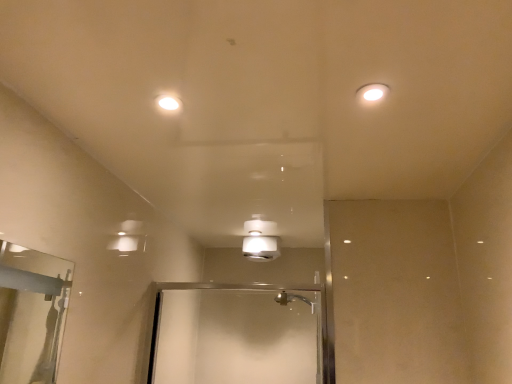
Measure the distance between white glossy light fixture at upper right, the 2th light fixture positioned from the left, and camera.

They are 3.59 feet apart.

What do you see at coordinates (372, 93) in the screenshot?
I see `white glossy light fixture at upper right, which is the 1th light fixture in top-to-bottom order` at bounding box center [372, 93].

You are a GUI agent. You are given a task and a screenshot of the screen. Output one action in this format:
    pyautogui.click(x=<x>, y=<y>)
    Task: Click on the white glossy light fixture at upper right, the 1th light fixture positioned from the front
    The image size is (512, 384).
    Given the screenshot: What is the action you would take?
    pyautogui.click(x=372, y=93)

This screenshot has width=512, height=384. What do you see at coordinates (259, 241) in the screenshot?
I see `white glossy light fixture at center, which ranks as the 1th light fixture in bottom-to-top order` at bounding box center [259, 241].

At what (x,y) coordinates should I click in order to perform the action: click on white glossy light fixture at center, which is counted as the second light fixture, starting from the front. Please return your answer as a coordinate pair (x, y). The image size is (512, 384). Looking at the image, I should click on (259, 241).

Measure the distance between white glossy light fixture at center, the first light fixture when ordered from left to right, and camera.

white glossy light fixture at center, the first light fixture when ordered from left to right, and camera are 7.42 feet apart.

Image resolution: width=512 pixels, height=384 pixels. I want to click on white glossy light fixture at upper right, the 1th light fixture positioned from the front, so click(372, 93).

Looking at this image, visually, is white glossy light fixture at center, which is counted as the second light fixture, starting from the front, positioned to the left or to the right of white glossy light fixture at upper right, which is the 1th light fixture in top-to-bottom order?

In the image, white glossy light fixture at center, which is counted as the second light fixture, starting from the front, appears on the left side of white glossy light fixture at upper right, which is the 1th light fixture in top-to-bottom order.

Considering the positions of objects white glossy light fixture at center, which is counted as the second light fixture, starting from the front, and white glossy light fixture at upper right, the second light fixture viewed from the back, in the image provided, who is in front, white glossy light fixture at center, which is counted as the second light fixture, starting from the front, or white glossy light fixture at upper right, the second light fixture viewed from the back,?

white glossy light fixture at upper right, the second light fixture viewed from the back.

Which point is more distant from viewer, [264,236] or [369,95]?

Positioned behind is point [264,236].

From the image's perspective, would you say white glossy light fixture at center, which ranks as the 1th light fixture in bottom-to-top order, is positioned over white glossy light fixture at upper right, the 2th light fixture positioned from the left?

Actually, white glossy light fixture at center, which ranks as the 1th light fixture in bottom-to-top order, appears below white glossy light fixture at upper right, the 2th light fixture positioned from the left, in the image.

From a real-world perspective, does white glossy light fixture at center, which is the 2th light fixture from top to bottom, sit lower than white glossy light fixture at upper right, the second light fixture viewed from the back?

Indeed, from a real-world perspective, white glossy light fixture at center, which is the 2th light fixture from top to bottom, is positioned beneath white glossy light fixture at upper right, the second light fixture viewed from the back.

Which object is wider, white glossy light fixture at center, which ranks as the 1th light fixture in bottom-to-top order, or white glossy light fixture at upper right, the second light fixture in the bottom-to-top sequence?

white glossy light fixture at center, which ranks as the 1th light fixture in bottom-to-top order.

In terms of height, does white glossy light fixture at center, the first light fixture when ordered from left to right, look taller or shorter compared to white glossy light fixture at upper right, the 2th light fixture positioned from the left?

Clearly, white glossy light fixture at center, the first light fixture when ordered from left to right, is taller compared to white glossy light fixture at upper right, the 2th light fixture positioned from the left.

Is white glossy light fixture at center, the second light fixture from the right, bigger or smaller than white glossy light fixture at upper right, the second light fixture in the bottom-to-top sequence?

Clearly, white glossy light fixture at center, the second light fixture from the right, is larger in size than white glossy light fixture at upper right, the second light fixture in the bottom-to-top sequence.

Which is correct: white glossy light fixture at center, which ranks as the 1th light fixture in bottom-to-top order, is inside white glossy light fixture at upper right, the 1th light fixture positioned from the front, or outside of it?

white glossy light fixture at center, which ranks as the 1th light fixture in bottom-to-top order, is spatially situated outside white glossy light fixture at upper right, the 1th light fixture positioned from the front.

Is the surface of white glossy light fixture at center, which ranks as the 1th light fixture in bottom-to-top order, in direct contact with white glossy light fixture at upper right, the 2th light fixture positioned from the left?

No, white glossy light fixture at center, which ranks as the 1th light fixture in bottom-to-top order, is not touching white glossy light fixture at upper right, the 2th light fixture positioned from the left.

Is white glossy light fixture at center, which is counted as the second light fixture, starting from the front, oriented away from white glossy light fixture at upper right, the second light fixture in the bottom-to-top sequence?

white glossy light fixture at center, which is counted as the second light fixture, starting from the front, is not turned away from white glossy light fixture at upper right, the second light fixture in the bottom-to-top sequence.

What's the angular difference between white glossy light fixture at center, which appears as the first light fixture when viewed from the back, and white glossy light fixture at upper right, which is the 1th light fixture in top-to-bottom order,'s facing directions?

There is a 0.00252-degree angle between the facing directions of white glossy light fixture at center, which appears as the first light fixture when viewed from the back, and white glossy light fixture at upper right, which is the 1th light fixture in top-to-bottom order.

How much distance is there between white glossy light fixture at center, the first light fixture when ordered from left to right, and white glossy light fixture at upper right, arranged as the first light fixture when viewed from the right?

The distance of white glossy light fixture at center, the first light fixture when ordered from left to right, from white glossy light fixture at upper right, arranged as the first light fixture when viewed from the right, is 1.49 meters.

Where is `light fixture beneath the white glossy light fixture at upper right, arranged as the first light fixture when viewed from the right (from a real-world perspective)`? The image size is (512, 384). light fixture beneath the white glossy light fixture at upper right, arranged as the first light fixture when viewed from the right (from a real-world perspective) is located at coordinates (259, 241).

Which is more to the right, white glossy light fixture at upper right, the second light fixture in the bottom-to-top sequence, or white glossy light fixture at center, which is the 2th light fixture from top to bottom?

Positioned to the right is white glossy light fixture at upper right, the second light fixture in the bottom-to-top sequence.

Which object is closer to the camera, white glossy light fixture at upper right, which is the 1th light fixture in top-to-bottom order, or white glossy light fixture at center, the second light fixture from the right?

white glossy light fixture at upper right, which is the 1th light fixture in top-to-bottom order, is more forward.

Does point (375, 85) come farther from viewer compared to point (254, 223)?

No, it is in front of (254, 223).

From the image's perspective, which object appears higher, white glossy light fixture at upper right, the 2th light fixture positioned from the left, or white glossy light fixture at center, which appears as the first light fixture when viewed from the back?

From the image's view, white glossy light fixture at upper right, the 2th light fixture positioned from the left, is above.

From a real-world perspective, who is located lower, white glossy light fixture at upper right, the second light fixture viewed from the back, or white glossy light fixture at center, which is counted as the second light fixture, starting from the front?

white glossy light fixture at center, which is counted as the second light fixture, starting from the front, from a real-world perspective.

Is white glossy light fixture at upper right, arranged as the first light fixture when viewed from the right, wider or thinner than white glossy light fixture at center, which is counted as the second light fixture, starting from the front?

white glossy light fixture at upper right, arranged as the first light fixture when viewed from the right, is thinner than white glossy light fixture at center, which is counted as the second light fixture, starting from the front.

Is white glossy light fixture at upper right, arranged as the first light fixture when viewed from the right, taller than white glossy light fixture at center, which appears as the first light fixture when viewed from the back?

No.

From the picture: Is white glossy light fixture at upper right, the 2th light fixture positioned from the left, bigger or smaller than white glossy light fixture at center, which is the 2th light fixture from top to bottom?

→ white glossy light fixture at upper right, the 2th light fixture positioned from the left, is smaller than white glossy light fixture at center, which is the 2th light fixture from top to bottom.

Is white glossy light fixture at upper right, the 1th light fixture positioned from the front, spatially inside white glossy light fixture at center, which is the 2th light fixture from top to bottom, or outside of it?

white glossy light fixture at upper right, the 1th light fixture positioned from the front, cannot be found inside white glossy light fixture at center, which is the 2th light fixture from top to bottom.

Is white glossy light fixture at upper right, the 2th light fixture positioned from the left, not close to white glossy light fixture at center, the first light fixture when ordered from left to right?

white glossy light fixture at upper right, the 2th light fixture positioned from the left, is positioned a significant distance from white glossy light fixture at center, the first light fixture when ordered from left to right.

Is white glossy light fixture at upper right, the second light fixture in the bottom-to-top sequence, oriented towards white glossy light fixture at center, the first light fixture when ordered from left to right?

No, white glossy light fixture at upper right, the second light fixture in the bottom-to-top sequence, does not turn towards white glossy light fixture at center, the first light fixture when ordered from left to right.

What's the angular difference between white glossy light fixture at upper right, the second light fixture in the bottom-to-top sequence, and white glossy light fixture at center, which appears as the first light fixture when viewed from the back,'s facing directions?

0.00252 degrees.

I want to click on light fixture on the right of white glossy light fixture at center, which is the 2th light fixture from top to bottom, so click(x=372, y=93).

Locate an element on the screen. The height and width of the screenshot is (384, 512). light fixture on the left of white glossy light fixture at upper right, arranged as the first light fixture when viewed from the right is located at coordinates (259, 241).

You are a GUI agent. You are given a task and a screenshot of the screen. Output one action in this format:
    pyautogui.click(x=<x>, y=<y>)
    Task: Click on the light fixture in front of the white glossy light fixture at center, which appears as the first light fixture when viewed from the back
    The image size is (512, 384).
    Given the screenshot: What is the action you would take?
    click(372, 93)